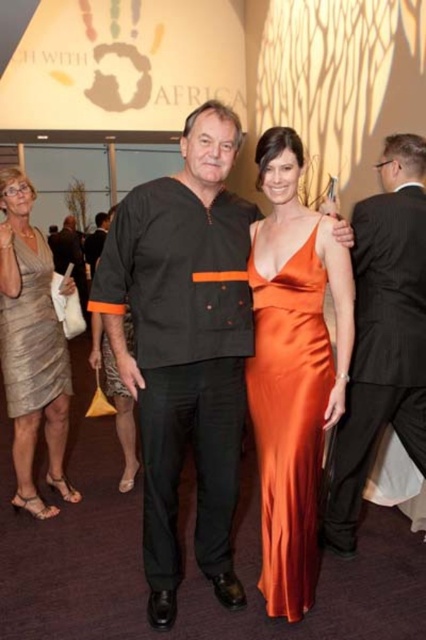
Who is taller, shiny silver dress at center or metallic gold dress at left?

Standing taller between the two is shiny silver dress at center.

Is shiny silver dress at center positioned in front of metallic gold dress at left?

Yes, shiny silver dress at center is in front of metallic gold dress at left.

Is point (51, 356) less distant than point (8, 358)?

No.

Find the location of `shiny silver dress at center`. shiny silver dress at center is located at coordinates (31, 348).

Between point (368, 236) and point (267, 579), which one is positioned in front?

Point (267, 579) is in front.

Which is in front, point (368, 275) or point (325, 371)?

Point (325, 371) is in front.

Where is `satin black suit at center`? This screenshot has width=426, height=640. satin black suit at center is located at coordinates (382, 333).

Is point (141, 189) less distant than point (273, 550)?

Yes, it is.

Locate an element on the screen. The height and width of the screenshot is (640, 426). black matte shirt at center is located at coordinates (184, 346).